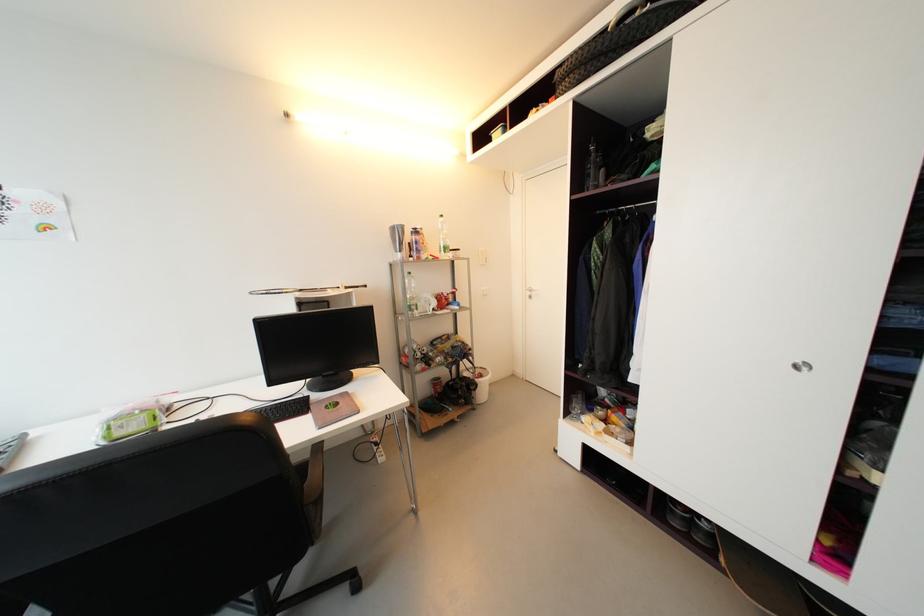
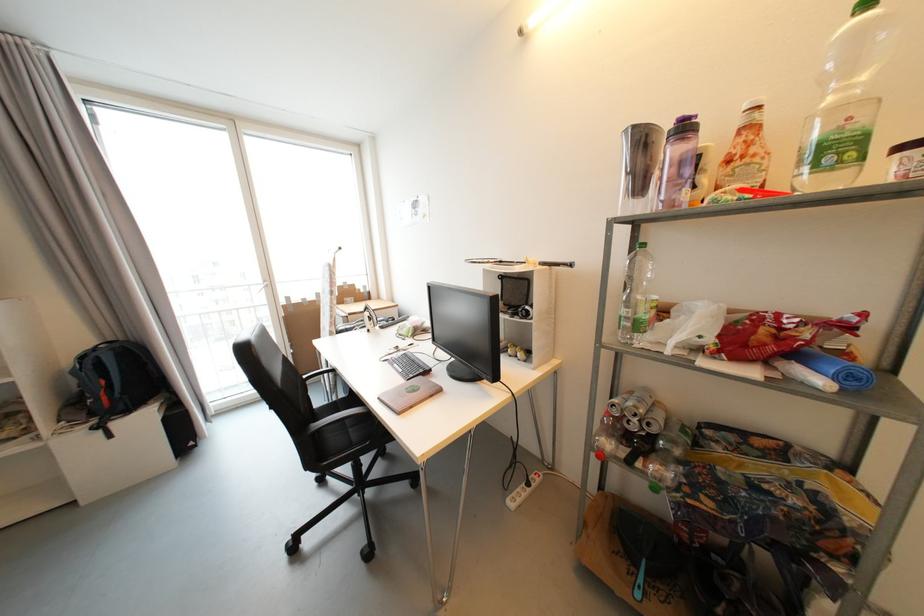
Where in the second image is the point corresponding to (x=451, y=251) from the first image?

(842, 151)